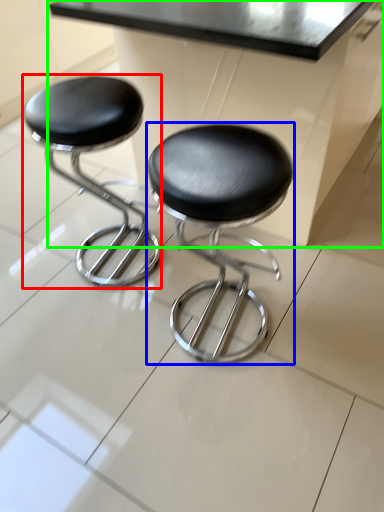
Question: Estimate the real-world distances between objects in this image. Which object is closer to stool (highlighted by a red box), stool (highlighted by a blue box) or table (highlighted by a green box)?

Choices:
 (A) stool
 (B) table

Answer: (B)